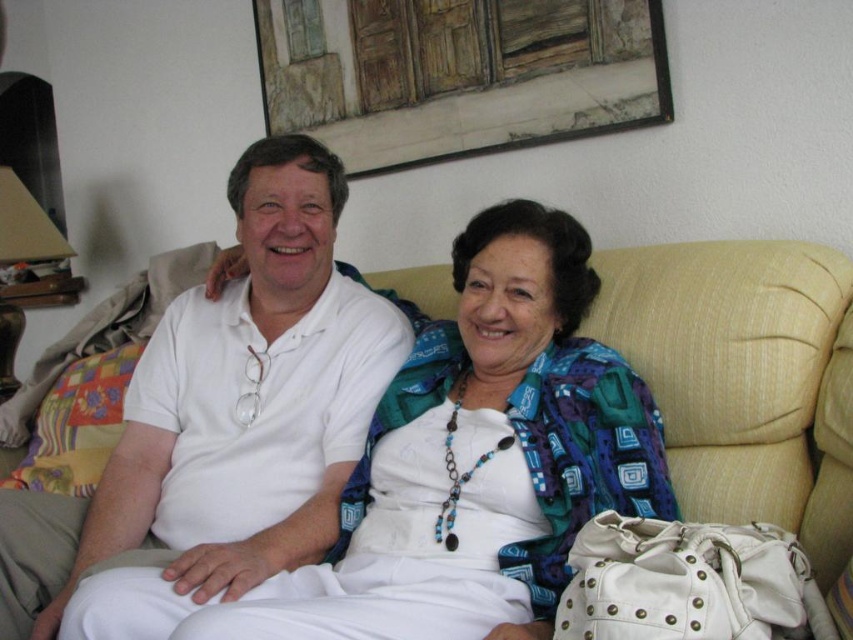
You are standing in the living room and want to place a small decoration at point (228, 412). Which object is at that location?

The point (228, 412) is on the white matte shirt at center.

Based on the photo, you are a photographer setting up for a portrait session in the living room. You need to ensure that the white matte shirt at center is clearly visible against the beige fabric couch at center. Based on their positions, will the contrast between the two objects help in achieving this?

The white matte shirt at center is in front of the beige fabric couch at center, so the contrast between the two objects will help the white matte shirt at center stand out against the beige fabric couch at center.

You are a photographer setting up a shoot in the living room. You need to ensure that the white matte shirt at center and the beige fabric couch at center are both visible in the frame. Given their sizes, which object should you prioritize positioning closer to the camera to maintain their visibility?

The white matte shirt at center has a larger size compared to the beige fabric couch at center, so you should prioritize positioning the beige fabric couch at center closer to the camera to maintain visibility since it is smaller and might be less noticeable if farther away.